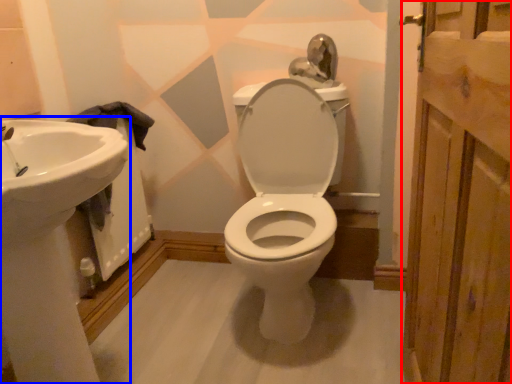
Question: Among these objects, which one is nearest to the camera, screen door (highlighted by a red box) or sink (highlighted by a blue box)?

Choices:
 (A) screen door
 (B) sink

Answer: (A)